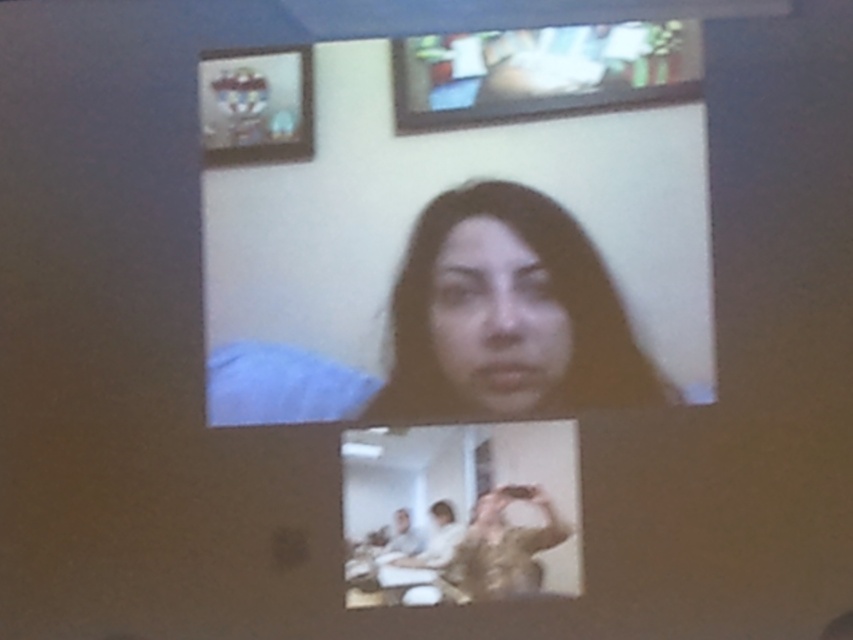
Does dark matte hair at center come behind smooth skin face at center?

No, dark matte hair at center is in front of smooth skin face at center.

Measure the distance between dark matte hair at center and camera.

8.98 feet

Is point (497, 264) less distant than point (466, 310)?

No, it is not.

Find the location of `dark matte hair at center`. dark matte hair at center is located at coordinates (508, 316).

Is matte black screen at center bigger than dark matte hair at center?

Correct, matte black screen at center is larger in size than dark matte hair at center.

Measure the distance from matte black screen at center to dark matte hair at center.

A distance of 3.35 inches exists between matte black screen at center and dark matte hair at center.

This screenshot has width=853, height=640. What are the coordinates of `matte black screen at center` in the screenshot? It's located at (469, 236).

Can you confirm if matte black screen at center is thinner than smooth skin face at center?

Incorrect, matte black screen at center's width is not less than smooth skin face at center's.

Does matte black screen at center have a greater height compared to smooth skin face at center?

Correct, matte black screen at center is much taller as smooth skin face at center.

The width and height of the screenshot is (853, 640). What do you see at coordinates (469, 236) in the screenshot? I see `matte black screen at center` at bounding box center [469, 236].

Locate an element on the screen. This screenshot has width=853, height=640. matte black screen at center is located at coordinates (469, 236).